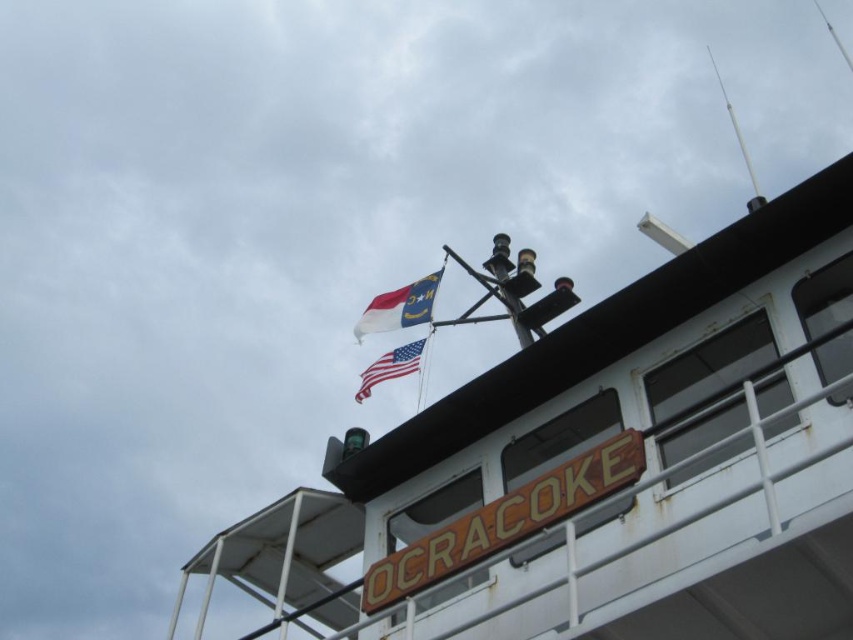
You are standing on the deck of the boat and looking at the white matte boat at upper center and the matte plastic flag at upper center. Which object is nearer to you?

The white matte boat at upper center is closer to the viewer than the matte plastic flag at upper center.

You are a sailor on the OCRACOKE boat deck. You notice two flags at the upper center of the deck. Which flag is positioned higher between the matte plastic flag at upper center and the american flag at upper center?

The matte plastic flag at upper center is located above the american flag at upper center, so the matte plastic flag at upper center is positioned higher.